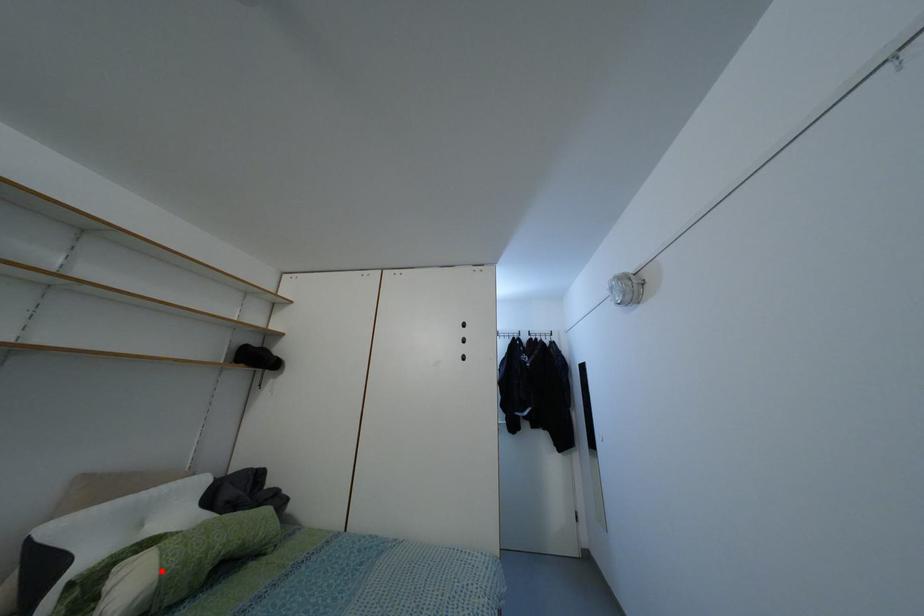
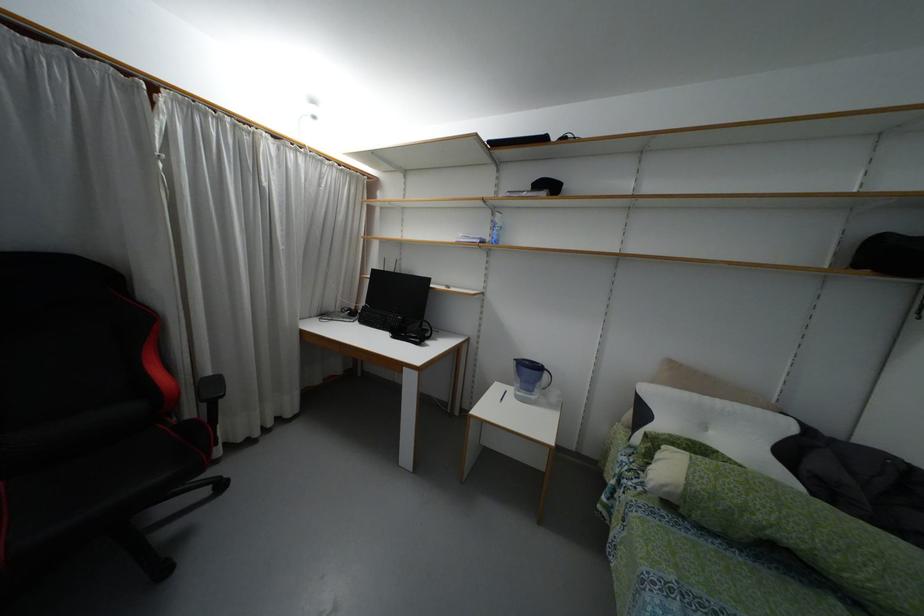
The point at the highlighted location is marked in the first image. Where is the corresponding point in the second image?

(687, 483)